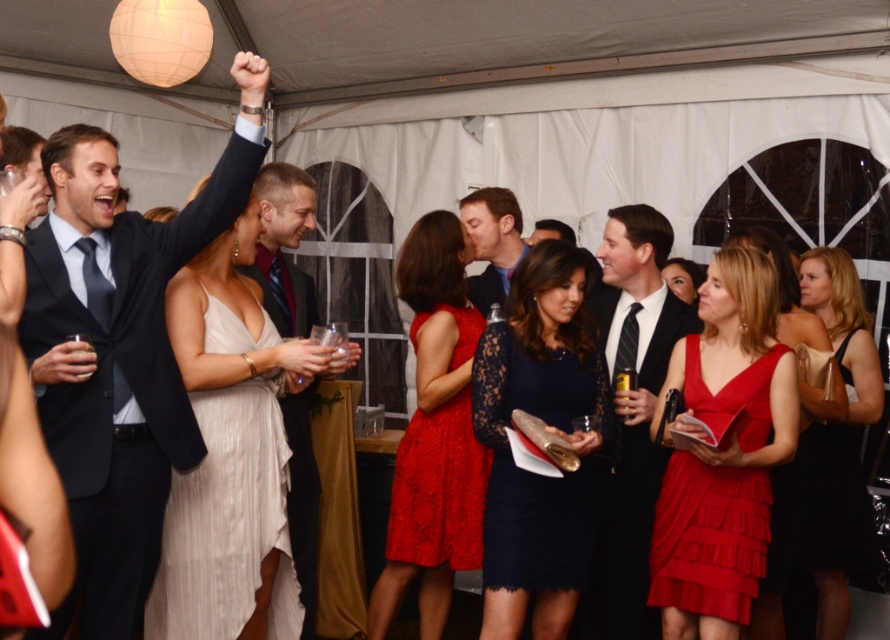
You are a photographer at the event and need to ensure all guests are visible in the group photo. The matte black suit at center and the black tie at center are in the same row. Considering their heights, which one might need to stand on a platform to be seen better?

The matte black suit at center has a greater height compared to the black tie at center, so the black tie at center might need to stand on a platform to be seen better.